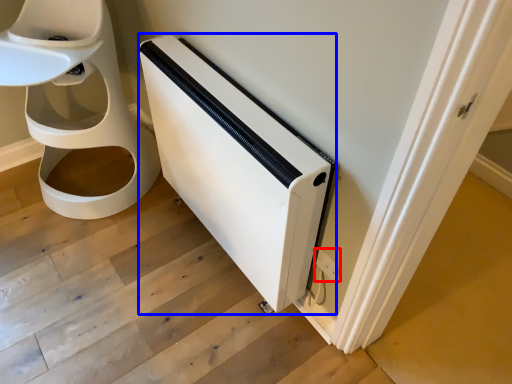
Question: Which object appears farthest to the camera in this image, electric outlet (highlighted by a red box) or appliance (highlighted by a blue box)?

Choices:
 (A) electric outlet
 (B) appliance

Answer: (A)